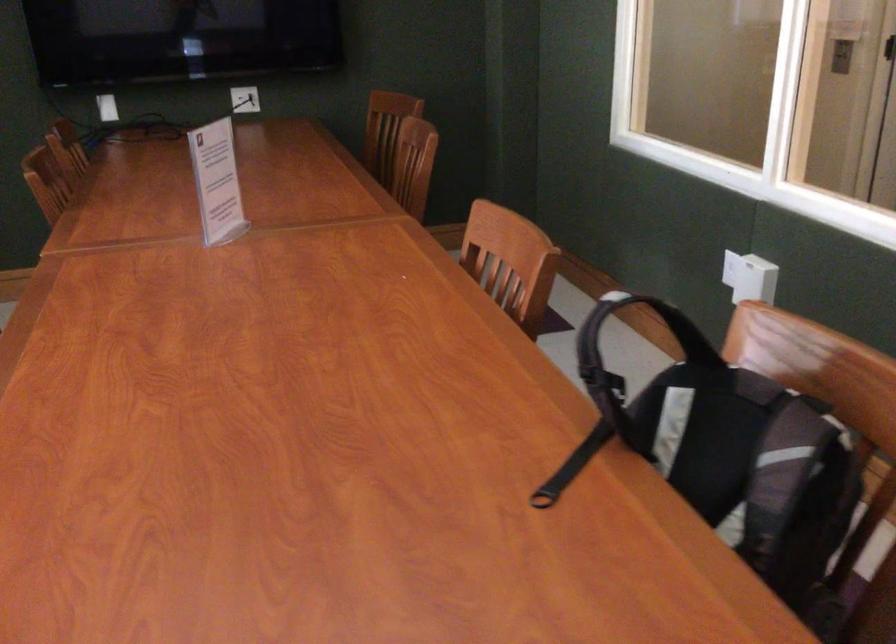
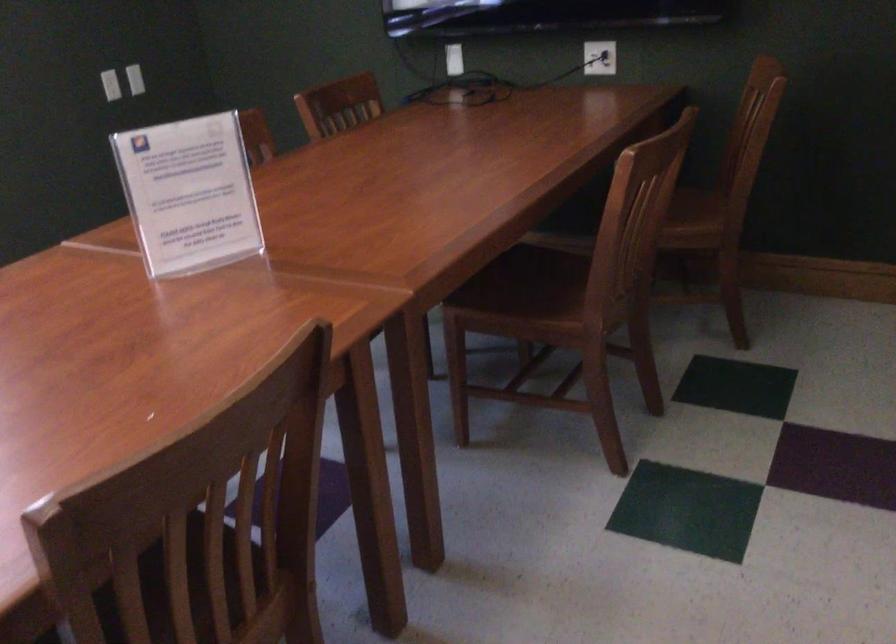
The point at (x=217, y=178) is marked in the first image. Where is the corresponding point in the second image?

(188, 194)